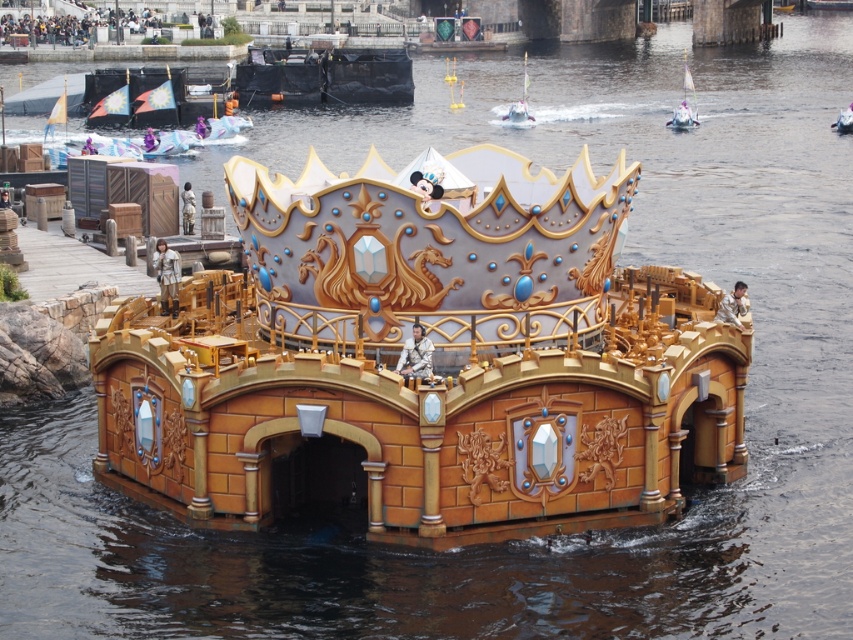
Does point (685, 120) come farther from viewer compared to point (511, 108)?

No, it is in front of (511, 108).

Between point (689, 109) and point (523, 60), which one is positioned behind?

The point (523, 60) is behind.

What are the coordinates of `white glossy sailboat at upper right` in the screenshot? It's located at (685, 104).

Between white glossy sailboat at upper right and metallic silver boat at center, which one appears on the right side from the viewer's perspective?

Positioned to the right is metallic silver boat at center.

Is white glossy sailboat at upper right bigger than metallic silver boat at center?

Yes, white glossy sailboat at upper right is bigger than metallic silver boat at center.

Who is more forward, (689, 81) or (846, 122)?

Point (846, 122) is more forward.

Image resolution: width=853 pixels, height=640 pixels. Identify the location of white glossy sailboat at upper right. [685, 104].

Is metallic silver sailboat at upper center to the left of metallic silver boat at center from the viewer's perspective?

Indeed, metallic silver sailboat at upper center is positioned on the left side of metallic silver boat at center.

Which is in front, point (523, 106) or point (845, 115)?

Positioned in front is point (845, 115).

Where is `metallic silver sailboat at upper center`? This screenshot has height=640, width=853. metallic silver sailboat at upper center is located at coordinates (520, 104).